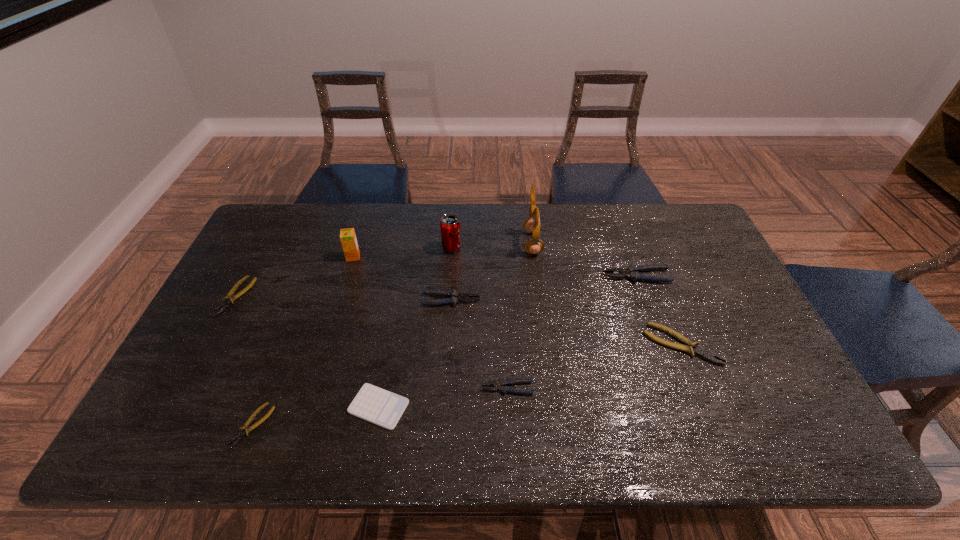
Image resolution: width=960 pixels, height=540 pixels. Identify the location of free space at the far edge of the desktop. click(x=415, y=215).

This screenshot has width=960, height=540. What are the coordinates of `vacant space at the near edge` in the screenshot? It's located at (482, 444).

Locate an element on the screen. free space at the left edge is located at coordinates (214, 307).

You are a GUI agent. You are given a task and a screenshot of the screen. Output one action in this format:
    pyautogui.click(x=<x>, y=<y>)
    Task: Click on the free spot at the right edge of the desktop
    The height and width of the screenshot is (540, 960).
    Given the screenshot: What is the action you would take?
    pyautogui.click(x=685, y=285)

Where is `free region at the far right corner of the desktop`? free region at the far right corner of the desktop is located at coordinates (680, 228).

Identify the location of free area in between the second yellow pliers from right to left and the calculator. [316, 416].

What are the coordinates of `vacant area that lies between the smallest yellow pliers and the third object from right to left` in the screenshot? It's located at (393, 334).

Locate an element on the screen. This screenshot has height=540, width=960. vacant space in between the farthest gray pliers and the seventh object from left to right is located at coordinates (572, 332).

Find the location of a particular element. vacant region between the orange juice and the biggest gray pliers is located at coordinates (494, 266).

The width and height of the screenshot is (960, 540). I want to click on blank region between the red soda can and the fifth shortest pliers, so click(x=451, y=274).